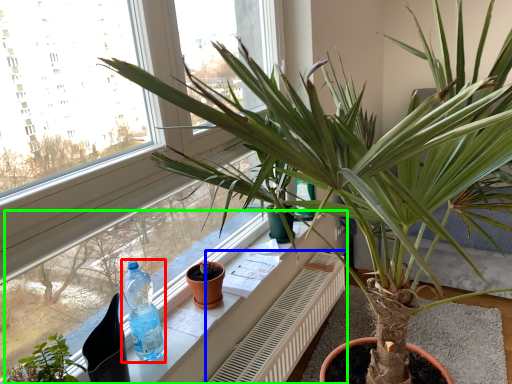
Question: Considering the real-world distances, which object is farthest from bottle (highlighted by a red box)? radiator (highlighted by a blue box) or window sill (highlighted by a green box)?

Choices:
 (A) radiator
 (B) window sill

Answer: (A)